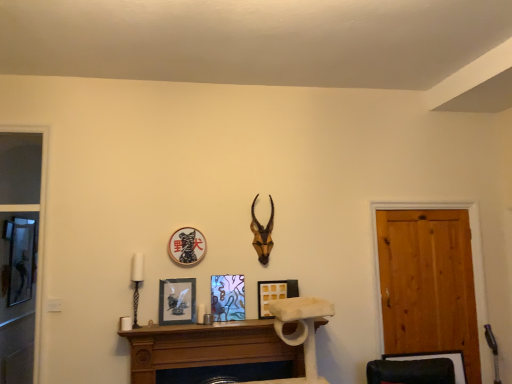
The height and width of the screenshot is (384, 512). In order to click on brown wooden fireplace at center in this screenshot , I will do `click(207, 349)`.

Measure the distance between brown wooden fireplace at center and camera.

brown wooden fireplace at center is 2.67 meters from camera.

At what (x,y) coordinates should I click in order to perform the action: click on wooden picture frame at center, the 1th picture frame in the right-to-left sequence. Please return your answer as a coordinate pair (x, y). The width and height of the screenshot is (512, 384). Looking at the image, I should click on (274, 294).

Measure the distance between wooden door at right and camera.

wooden door at right is 3.08 meters from camera.

Where is `black matte picture frame at center, which appears as the second picture frame when viewed from the left`? The image size is (512, 384). black matte picture frame at center, which appears as the second picture frame when viewed from the left is located at coordinates (187, 246).

Is wooden mantel at center thinner than metallic glass picture frame at center, placed as the 3th picture frame when sorted from left to right?

Incorrect, the width of wooden mantel at center is not less than that of metallic glass picture frame at center, placed as the 3th picture frame when sorted from left to right.

Is point (136, 332) positioned in front of point (217, 289)?

Yes, point (136, 332) is in front of point (217, 289).

Where is `the 3rd picture frame behind the wooden mantel at center, counting from the anchor's position`? This screenshot has width=512, height=384. the 3rd picture frame behind the wooden mantel at center, counting from the anchor's position is located at coordinates (228, 297).

What's the angular difference between wooden mantel at center and metallic glass picture frame at center, placed as the 3th picture frame when sorted from left to right,'s facing directions?

The facing directions of wooden mantel at center and metallic glass picture frame at center, placed as the 3th picture frame when sorted from left to right, are 0.85 degrees apart.

Based on the photo, which is in front, black matte picture frame at center, which appears as the second picture frame when viewed from the left, or metallic glass picture frame at center, marked as the second picture frame in a right-to-left arrangement?

black matte picture frame at center, which appears as the second picture frame when viewed from the left, is more forward.

Consider the image. Is black matte picture frame at center, which appears as the second picture frame when viewed from the left, to the right of metallic glass picture frame at center, placed as the 3th picture frame when sorted from left to right, from the viewer's perspective?

In fact, black matte picture frame at center, which appears as the second picture frame when viewed from the left, is to the left of metallic glass picture frame at center, placed as the 3th picture frame when sorted from left to right.

Based on their sizes in the image, would you say black matte picture frame at center, the 3th picture frame when ordered from right to left, is bigger or smaller than metallic glass picture frame at center, marked as the second picture frame in a right-to-left arrangement?

In the image, black matte picture frame at center, the 3th picture frame when ordered from right to left, appears to be larger than metallic glass picture frame at center, marked as the second picture frame in a right-to-left arrangement.

From the image's perspective, is black matte picture frame at center, which appears as the second picture frame when viewed from the left, on metallic glass picture frame at center, placed as the 3th picture frame when sorted from left to right?

Correct, black matte picture frame at center, which appears as the second picture frame when viewed from the left, appears higher than metallic glass picture frame at center, placed as the 3th picture frame when sorted from left to right, in the image.

Considering the sizes of objects wooden picture frame at center, the 1th picture frame in the right-to-left sequence, and brown wooden antler at upper center in the image provided, who is smaller, wooden picture frame at center, the 1th picture frame in the right-to-left sequence, or brown wooden antler at upper center?

Smaller between the two is wooden picture frame at center, the 1th picture frame in the right-to-left sequence.

Consider the image. From the image's perspective, is wooden picture frame at center, the fourth picture frame from the left, located above brown wooden antler at upper center?

Actually, wooden picture frame at center, the fourth picture frame from the left, appears below brown wooden antler at upper center in the image.

Considering the sizes of objects wooden picture frame at center, the 1th picture frame in the right-to-left sequence, and brown wooden antler at upper center in the image provided, who is wider, wooden picture frame at center, the 1th picture frame in the right-to-left sequence, or brown wooden antler at upper center?

Wider between the two is brown wooden antler at upper center.

From a real-world perspective, is wooden picture frame at center, the fourth picture frame from the left, physically below brown wooden antler at upper center?

Correct, in the physical world, wooden picture frame at center, the fourth picture frame from the left, is lower than brown wooden antler at upper center.

From a real-world perspective, is brown wooden fireplace at center positioned above or below black matte picture frame at center, the 3th picture frame when ordered from right to left?

brown wooden fireplace at center is situated lower than black matte picture frame at center, the 3th picture frame when ordered from right to left, in the real world.

Can black matte picture frame at center, which appears as the second picture frame when viewed from the left, be found inside brown wooden fireplace at center?

No, black matte picture frame at center, which appears as the second picture frame when viewed from the left, is located outside of brown wooden fireplace at center.

Looking at this image, is brown wooden fireplace at center turned away from black matte picture frame at center, the 3th picture frame when ordered from right to left?

No, brown wooden fireplace at center is not facing away from black matte picture frame at center, the 3th picture frame when ordered from right to left.

Is brown wooden antler at upper center positioned in front of metallic glass picture frame at center, placed as the 3th picture frame when sorted from left to right?

No.

From the image's perspective, which one is positioned lower, brown wooden antler at upper center or metallic glass picture frame at center, marked as the second picture frame in a right-to-left arrangement?

metallic glass picture frame at center, marked as the second picture frame in a right-to-left arrangement, is shown below in the image.

Can you confirm if brown wooden antler at upper center is wider than metallic glass picture frame at center, marked as the second picture frame in a right-to-left arrangement?

Yes, brown wooden antler at upper center is wider than metallic glass picture frame at center, marked as the second picture frame in a right-to-left arrangement.

Consider the image. Considering the sizes of brown wooden antler at upper center and metallic glass picture frame at center, placed as the 3th picture frame when sorted from left to right, in the image, is brown wooden antler at upper center bigger or smaller than metallic glass picture frame at center, placed as the 3th picture frame when sorted from left to right,?

Clearly, brown wooden antler at upper center is larger in size than metallic glass picture frame at center, placed as the 3th picture frame when sorted from left to right.

Can you confirm if wooden door at right is smaller than brown wooden antler at upper center?

Actually, wooden door at right might be larger than brown wooden antler at upper center.

This screenshot has width=512, height=384. I want to click on animal on the left of wooden door at right, so click(x=262, y=234).

Is wooden door at right taller or shorter than brown wooden antler at upper center?

wooden door at right is taller than brown wooden antler at upper center.

From the image's perspective, would you say wooden door at right is positioned over brown wooden antler at upper center?

No, from the image's perspective, wooden door at right is not above brown wooden antler at upper center.

What's the angular difference between brown wooden fireplace at center and wooden mantel at center's facing directions?

0.000818 degrees separate the facing orientations of brown wooden fireplace at center and wooden mantel at center.

Can you confirm if brown wooden fireplace at center is shorter than wooden mantel at center?

Incorrect, the height of brown wooden fireplace at center does not fall short of that of wooden mantel at center.

Who is smaller, brown wooden fireplace at center or wooden mantel at center?

With smaller size is wooden mantel at center.

Is point (249, 379) farther from viewer compared to point (199, 326)?

Yes, it is.

In order to click on the 3rd picture frame above when counting from the wooden mantel at center (from the image's perspective) in this screenshot , I will do `click(228, 297)`.

The image size is (512, 384). Identify the location of the 1st picture frame in front of the metallic glass picture frame at center, marked as the second picture frame in a right-to-left arrangement, counting from the anchor's position. (187, 246).

Considering their positions, is brown wooden antler at upper center positioned further to wooden door at right than white ceramic candle holder at left?

Based on the image, white ceramic candle holder at left appears to be further to wooden door at right.

Looking at the image, which one is located closer to brown wooden antler at upper center, wooden door at right or wooden picture frame at center, the 1th picture frame in the right-to-left sequence?

wooden picture frame at center, the 1th picture frame in the right-to-left sequence, is positioned closer to the anchor brown wooden antler at upper center.

From the image, which object appears to be nearer to wooden picture frame at center, the fourth picture frame from the left, brown wooden fireplace at center or metallic glass picture frame at center, placed as the 3th picture frame when sorted from left to right?

metallic glass picture frame at center, placed as the 3th picture frame when sorted from left to right.

Estimate the real-world distances between objects in this image. Which object is closer to wooden picture frame at center, the fourth picture frame from the left, brown wooden antler at upper center or white ceramic candle holder at left?

The object closer to wooden picture frame at center, the fourth picture frame from the left, is brown wooden antler at upper center.

Which object lies nearer to the anchor point metallic glass picture frame at center, marked as the second picture frame in a right-to-left arrangement, wooden picture frame at center, the 1th picture frame in the right-to-left sequence, or black matte picture frame at center, which appears as the second picture frame when viewed from the left?

Based on the image, wooden picture frame at center, the 1th picture frame in the right-to-left sequence, appears to be nearer to metallic glass picture frame at center, marked as the second picture frame in a right-to-left arrangement.

Looking at the image, which one is located closer to black matte picture frame at center, the 3th picture frame when ordered from right to left, wooden picture frame at center, the fourth picture frame from the left, or matte black picture frame at center, which is counted as the 1th picture frame, starting from the left?

The object closer to black matte picture frame at center, the 3th picture frame when ordered from right to left, is matte black picture frame at center, which is counted as the 1th picture frame, starting from the left.

Based on their spatial positions, is brown wooden fireplace at center or wooden mantel at center closer to wooden door at right?

The object closer to wooden door at right is brown wooden fireplace at center.

From the image, which object appears to be nearer to brown wooden fireplace at center, wooden picture frame at center, the fourth picture frame from the left, or metallic glass picture frame at center, marked as the second picture frame in a right-to-left arrangement?

Among the two, metallic glass picture frame at center, marked as the second picture frame in a right-to-left arrangement, is located nearer to brown wooden fireplace at center.

The image size is (512, 384). Find the location of `mantle between wooden picture frame at center, the 1th picture frame in the right-to-left sequence, and brown wooden fireplace at center vertically`. mantle between wooden picture frame at center, the 1th picture frame in the right-to-left sequence, and brown wooden fireplace at center vertically is located at coordinates (190, 327).

Find the location of a particular element. mantle between metallic glass picture frame at center, placed as the 3th picture frame when sorted from left to right, and brown wooden fireplace at center vertically is located at coordinates (190, 327).

I want to click on animal between white ceramic candle holder at left and wooden picture frame at center, the fourth picture frame from the left, so (262, 234).

Where is `picture frame between metallic glass picture frame at center, marked as the second picture frame in a right-to-left arrangement, and wooden door at right from left to right`? picture frame between metallic glass picture frame at center, marked as the second picture frame in a right-to-left arrangement, and wooden door at right from left to right is located at coordinates (274, 294).